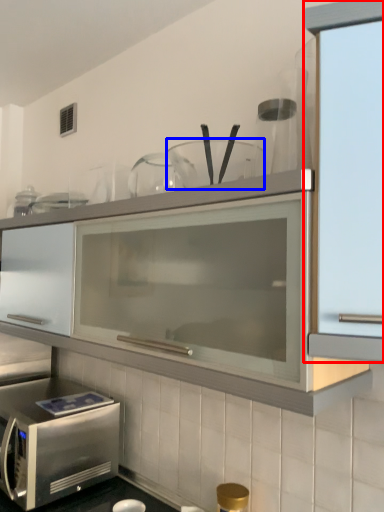
Question: Which object appears closest to the camera in this image, cabinetry (highlighted by a red box) or tableware (highlighted by a blue box)?

Choices:
 (A) cabinetry
 (B) tableware

Answer: (A)